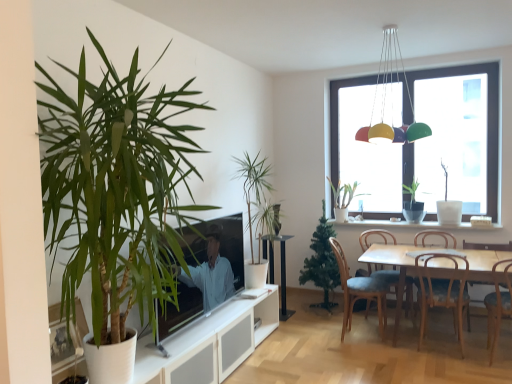
Question: Does wooden photo frame at lower left have a greater height compared to wooden chair with cushion at lower right, positioned as the 5th chair in right-to-left order?

Choices:
 (A) no
 (B) yes

Answer: (A)

Question: From the image's perspective, is wooden photo frame at lower left over wooden chair with cushion at lower right, which appears as the 1th chair when viewed from the left?

Choices:
 (A) no
 (B) yes

Answer: (B)

Question: Is wooden photo frame at lower left further to camera compared to wooden chair with cushion at lower right, positioned as the 5th chair in right-to-left order?

Choices:
 (A) yes
 (B) no

Answer: (B)

Question: Are wooden photo frame at lower left and wooden chair with cushion at lower right, which appears as the 1th chair when viewed from the left, far apart?

Choices:
 (A) no
 (B) yes

Answer: (B)

Question: Is wooden photo frame at lower left outside of wooden chair with cushion at lower right, positioned as the 5th chair in right-to-left order?

Choices:
 (A) no
 (B) yes

Answer: (B)

Question: Can you confirm if wooden photo frame at lower left is smaller than wooden chair with cushion at lower right, positioned as the 5th chair in right-to-left order?

Choices:
 (A) no
 (B) yes

Answer: (B)

Question: Is matte black tv at center to the right of green matte plant at window, the 2th houseplant in the back-to-front sequence, from the viewer's perspective?

Choices:
 (A) no
 (B) yes

Answer: (A)

Question: Can we say matte black tv at center lies outside green matte plant at window, arranged as the fifth houseplant when viewed from the front?

Choices:
 (A) yes
 (B) no

Answer: (A)

Question: From a real-world perspective, is matte black tv at center below green matte plant at window, the 2th houseplant in the back-to-front sequence?

Choices:
 (A) yes
 (B) no

Answer: (A)

Question: Does matte black tv at center turn towards green matte plant at window, the 5th houseplant when ordered from left to right?

Choices:
 (A) yes
 (B) no

Answer: (B)

Question: Is matte black tv at center bigger than green matte plant at window, the 2th houseplant in the back-to-front sequence?

Choices:
 (A) yes
 (B) no

Answer: (A)

Question: Does matte black tv at center have a smaller size compared to green matte plant at window, arranged as the fifth houseplant when viewed from the front?

Choices:
 (A) yes
 (B) no

Answer: (B)

Question: Is the position of white matte vase at right, which is the 3th houseplant in back-to-front order, more distant than that of wooden chair at lower right, the third chair positioned from the left?

Choices:
 (A) no
 (B) yes

Answer: (B)